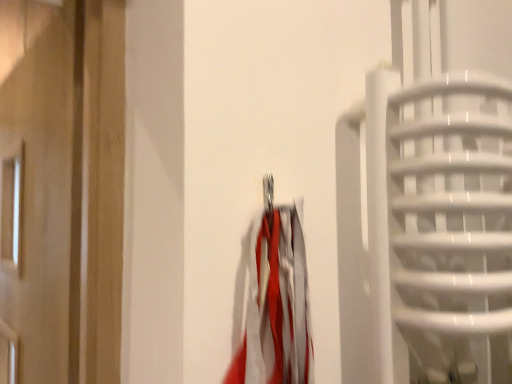
Describe the element at coordinates (62, 188) in the screenshot. This screenshot has height=384, width=512. I see `wooden door at left` at that location.

This screenshot has width=512, height=384. I want to click on wooden door at left, so [x=62, y=188].

I want to click on wooden door at left, so click(x=62, y=188).